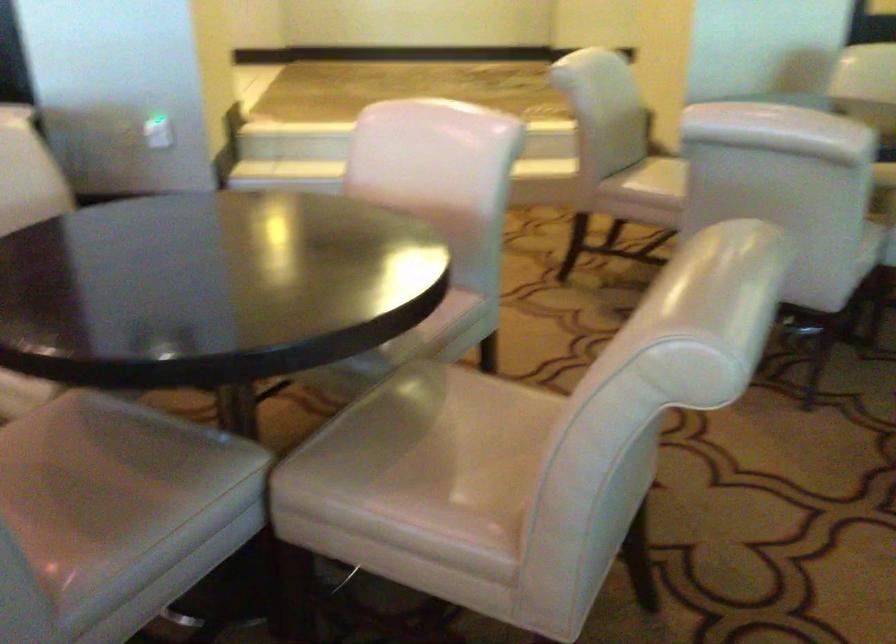
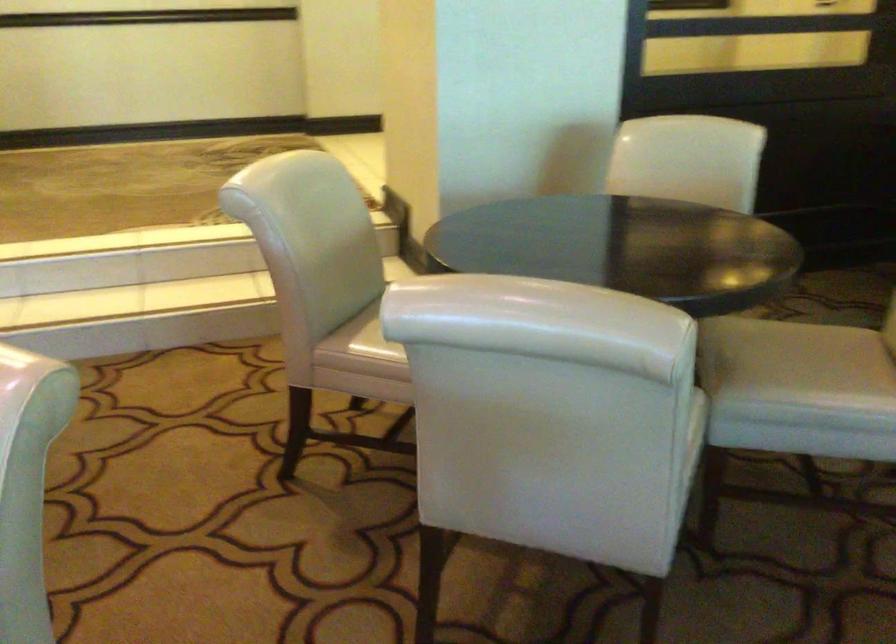
The images are taken continuously from a first-person perspective. In which direction are you moving?

The cameraman walked toward right, forward.